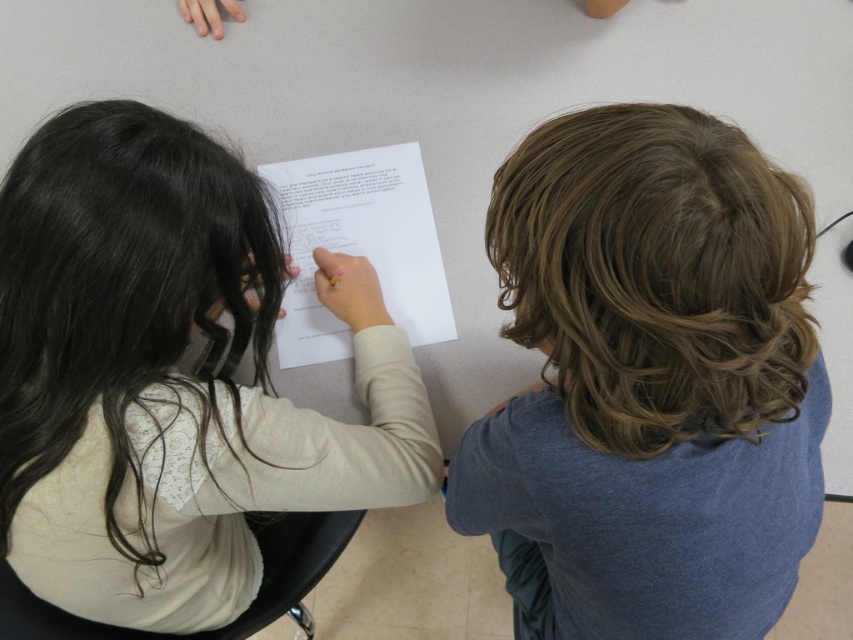
You are an observer looking at the scene. You notice the light beige lace shirt at center and the white paper at center. Which object is positioned lower in the image?

The light beige lace shirt at center is located below the white paper at center, so the light beige lace shirt at center is positioned lower in the image.

You are a photographer taking a portrait of the two people at the table. You want to ensure that the smooth brown hair at center is visible without being blocked by the light beige lace shirt at center. Based on the scene, is this possible?

Yes, because the smooth brown hair at center is in front of the light beige lace shirt at center, so it is not blocked and remains visible.

You are a photographer standing 15 inches away from the table. You want to take a photo of both the smooth brown hair at center and the light beige lace shirt at center so that both are fully visible in the frame. Can you position yourself in such a way that both objects are within the camera frame without moving the subjects?

The distance between the smooth brown hair at center and the light beige lace shirt at center is 10.46 inches. Since you are standing 15 inches away from the table, which is farther than the distance between the two objects, you can position the camera to capture both within the frame without needing to move the subjects.